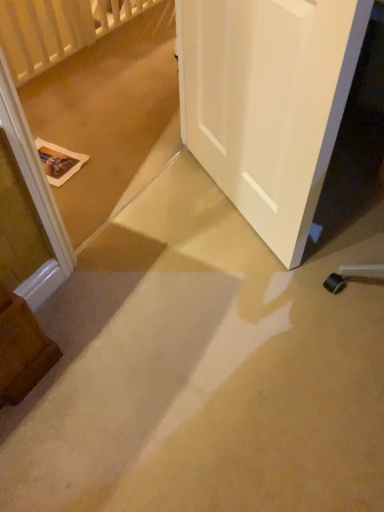
Question: From a real-world perspective, is white matte door at center positioned above or below beige carpet at lower center?

Choices:
 (A) above
 (B) below

Answer: (A)

Question: In the image, is white matte door at center positioned in front of or behind beige carpet at lower center?

Choices:
 (A) behind
 (B) front

Answer: (A)

Question: Which is farther from the beige carpet at lower center?

Choices:
 (A) white wooden balustrade at upper left
 (B) white matte door at center

Answer: (A)

Question: Considering the real-world distances, which object is closest to the white wooden balustrade at upper left?

Choices:
 (A) white matte door at center
 (B) beige carpet at lower center

Answer: (A)